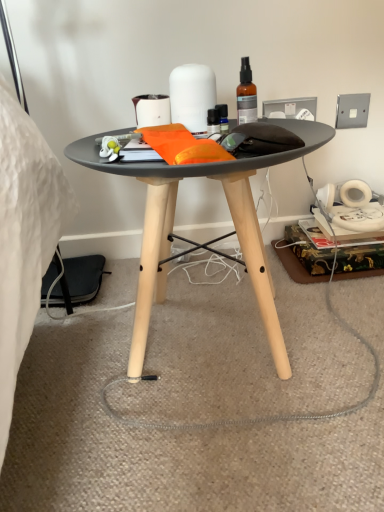
Question: From the image's perspective, is matte white toilet paper at upper center, which is the 1th toilet paper from left to right, over matte black table at center?

Choices:
 (A) yes
 (B) no

Answer: (A)

Question: Is matte black table at center completely or partially inside matte white toilet paper at upper center, which is the 1th toilet paper from left to right?

Choices:
 (A) yes
 (B) no

Answer: (B)

Question: Is matte white toilet paper at upper center, arranged as the 2th toilet paper when viewed from the right, behind matte black table at center?

Choices:
 (A) yes
 (B) no

Answer: (A)

Question: Could you tell me if matte white toilet paper at upper center, arranged as the 2th toilet paper when viewed from the right, is facing matte black table at center?

Choices:
 (A) yes
 (B) no

Answer: (B)

Question: Does matte white toilet paper at upper center, which is the 1th toilet paper from left to right, have a greater height compared to matte black table at center?

Choices:
 (A) no
 (B) yes

Answer: (A)

Question: Considering the relative positions of matte black table at center and matte white toilet paper at upper center, arranged as the 2th toilet paper when viewed from the right, in the image provided, is matte black table at center to the left or to the right of matte white toilet paper at upper center, arranged as the 2th toilet paper when viewed from the right,?

Choices:
 (A) right
 (B) left

Answer: (A)

Question: Is matte black table at center bigger or smaller than matte white toilet paper at upper center, arranged as the 2th toilet paper when viewed from the right?

Choices:
 (A) big
 (B) small

Answer: (A)

Question: In the image, is matte black table at center positioned in front of or behind matte white toilet paper at upper center, arranged as the 2th toilet paper when viewed from the right?

Choices:
 (A) front
 (B) behind

Answer: (A)

Question: Considering the positions of matte black table at center and matte white toilet paper at upper center, which is the 1th toilet paper from left to right, in the image, is matte black table at center wider or thinner than matte white toilet paper at upper center, which is the 1th toilet paper from left to right,?

Choices:
 (A) thin
 (B) wide

Answer: (B)

Question: From the image's perspective, is translucent amber glass spray bottle at upper center positioned above or below matte black table at center?

Choices:
 (A) above
 (B) below

Answer: (A)

Question: Considering the relative positions of translucent amber glass spray bottle at upper center and matte black table at center in the image provided, is translucent amber glass spray bottle at upper center to the left or to the right of matte black table at center?

Choices:
 (A) left
 (B) right

Answer: (B)

Question: From a real-world perspective, is translucent amber glass spray bottle at upper center above or below matte black table at center?

Choices:
 (A) below
 (B) above

Answer: (B)

Question: Considering the positions of translucent amber glass spray bottle at upper center and matte black table at center in the image, is translucent amber glass spray bottle at upper center wider or thinner than matte black table at center?

Choices:
 (A) thin
 (B) wide

Answer: (A)

Question: Is matte white toilet paper at upper center, arranged as the 2th toilet paper when viewed from the right, wider or thinner than white matte diffuser at upper center, the 2th toilet paper when ordered from left to right?

Choices:
 (A) thin
 (B) wide

Answer: (A)

Question: Looking at the image, does matte white toilet paper at upper center, arranged as the 2th toilet paper when viewed from the right, seem bigger or smaller compared to white matte diffuser at upper center, the 2th toilet paper when ordered from left to right?

Choices:
 (A) small
 (B) big

Answer: (A)